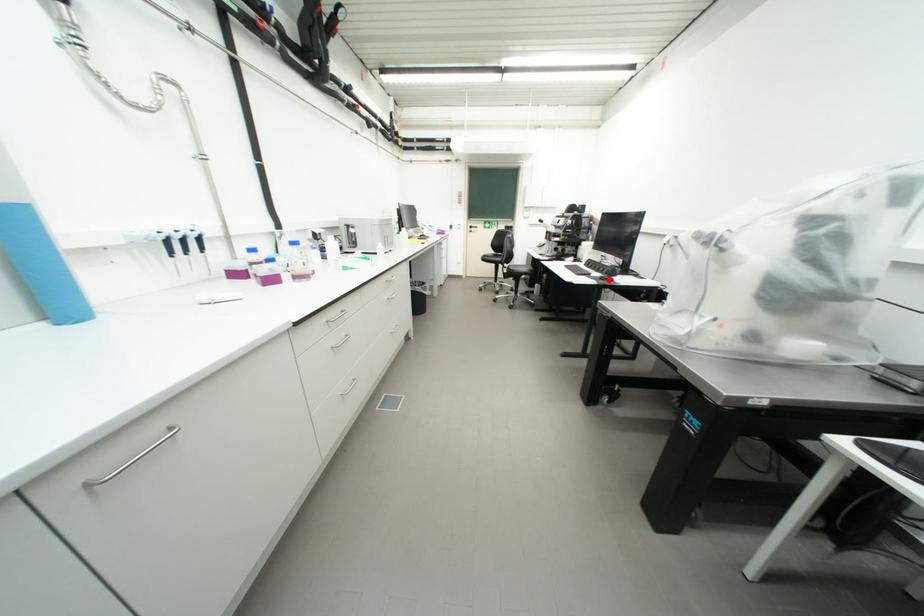
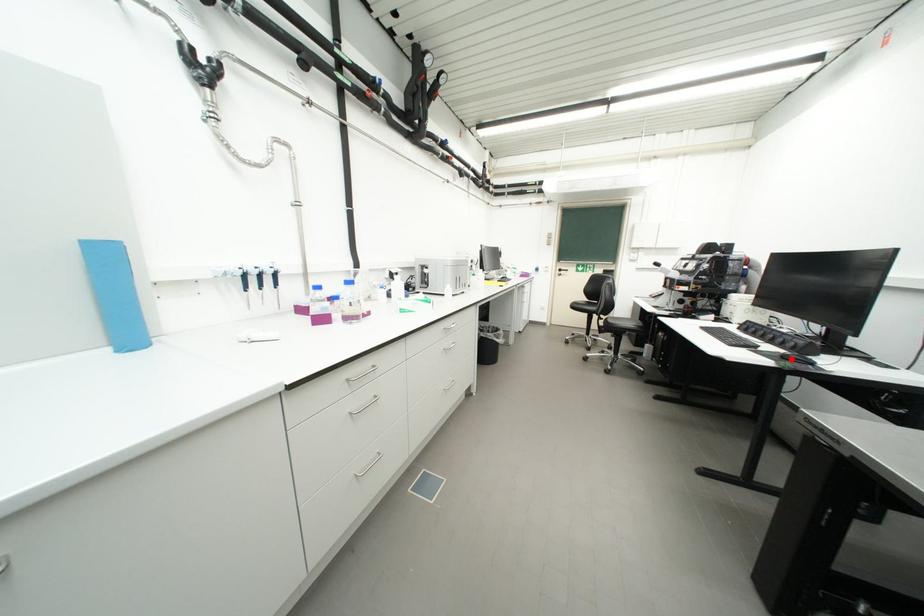
I am providing you with two images of the same scene from different viewpoints. A red point is marked on the first image and another point is marked on the second image. Is the marked point in image1 the same physical position as the marked point in image2?

Yes